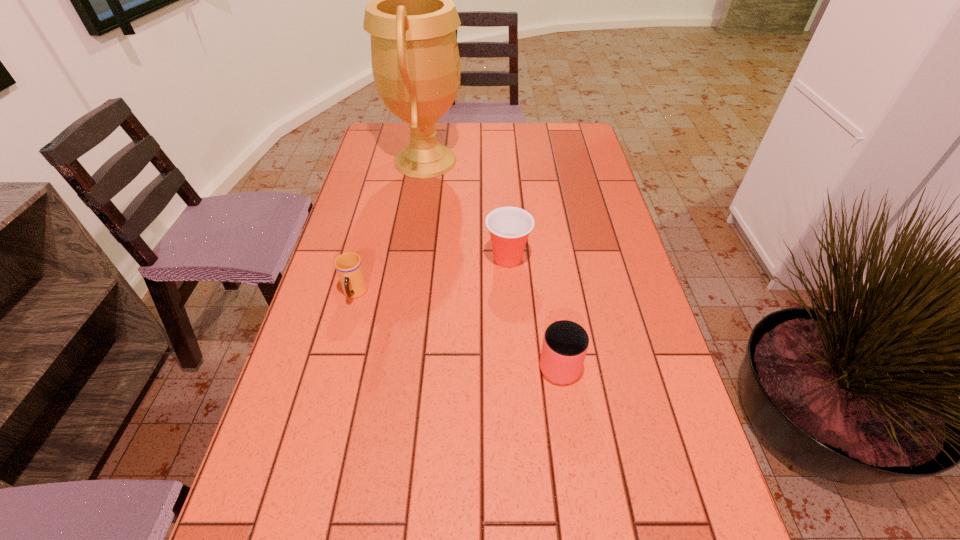
Locate an element on the screen. the farthest object is located at coordinates (412, 20).

Find the location of a particular element. The height and width of the screenshot is (540, 960). the tallest object is located at coordinates (412, 20).

Locate an element on the screen. the third nearest object is located at coordinates (509, 227).

Locate an element on the screen. This screenshot has height=540, width=960. the nearest object is located at coordinates (565, 344).

I want to click on the second nearest cup, so click(349, 267).

Where is `the third farthest object`? Image resolution: width=960 pixels, height=540 pixels. the third farthest object is located at coordinates (349, 267).

Locate an element on the screen. The image size is (960, 540). vacant space located on the engravings side of the farthest object is located at coordinates (514, 161).

This screenshot has height=540, width=960. Identify the location of vacant space located on the right of the second farthest object. (561, 259).

Identify the location of free space located on the handle side of the nearest cup. This screenshot has width=960, height=540. (550, 301).

Image resolution: width=960 pixels, height=540 pixels. What are the coordinates of `vacant space situated 0.180m on the handle side of the nearest cup` in the screenshot? It's located at (547, 280).